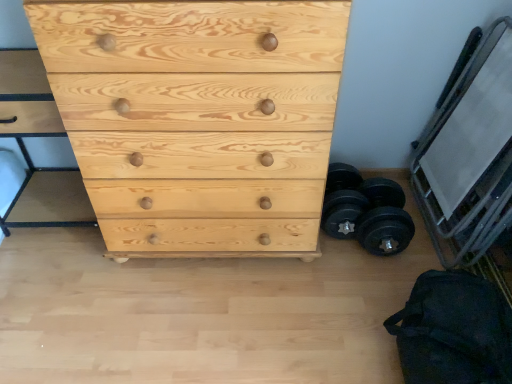
This screenshot has height=384, width=512. Find the location of `free location to the left of black fabric bag at lower right`. free location to the left of black fabric bag at lower right is located at coordinates (324, 323).